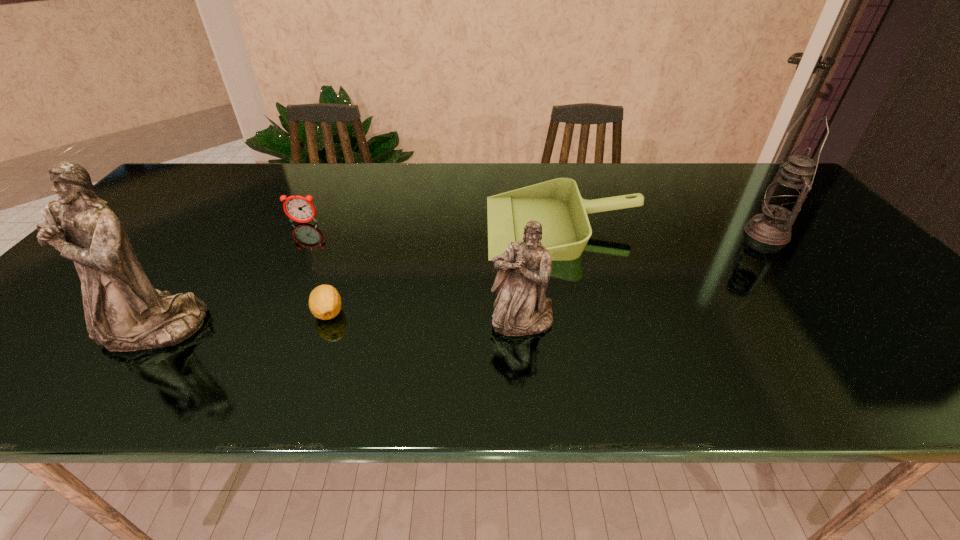
At what (x,y) coordinates should I click in order to perform the action: click on free space located 0.050m on the scoop of the dustpan. Please return your answer as a coordinate pair (x, y). Image resolution: width=960 pixels, height=540 pixels. Looking at the image, I should click on (469, 226).

This screenshot has height=540, width=960. Identify the location of vacant area situated 0.230m on the scoop of the dustpan. coord(406,226).

Locate an element on the screen. This screenshot has width=960, height=540. free space located on the scoop of the dustpan is located at coordinates (367, 226).

Image resolution: width=960 pixels, height=540 pixels. I want to click on blank space located on the front-facing side of the alarm clock, so click(x=290, y=249).

Locate an element on the screen. This screenshot has height=540, width=960. free location located 0.160m on the front of the rightmost object is located at coordinates (814, 289).

Where is `object situated at the far edge`? object situated at the far edge is located at coordinates (557, 204).

This screenshot has height=540, width=960. I want to click on lemon at the near edge, so click(324, 301).

Where is `object that is at the right edge`? The width and height of the screenshot is (960, 540). object that is at the right edge is located at coordinates (784, 198).

Find the location of `vacant space at the far edge`. vacant space at the far edge is located at coordinates (438, 174).

This screenshot has height=540, width=960. In the image, there is a desktop. Find the location of `vacant space at the near edge`. vacant space at the near edge is located at coordinates (786, 327).